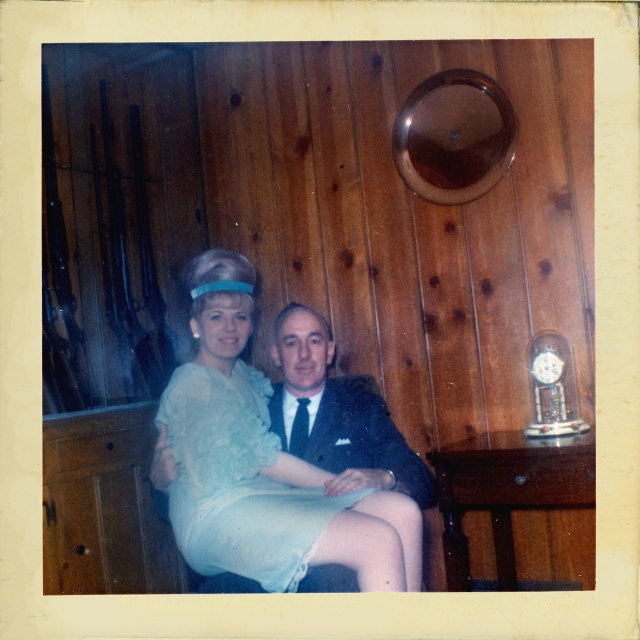
You are standing in front of the vintage photograph and want to touch the two points mentioned. Which point, point (262,572) or point (360,404), is closer to you?

Point (262,572) is closer to the viewer than point (360,404).

You are a photographer analyzing this vintage image. You notice the light blue lace dress at center and the dark blue suit at center. Which of these two items takes up more visual space in the photo?

The dark blue suit at center occupies more visual space than the light blue lace dress at center according to the description.